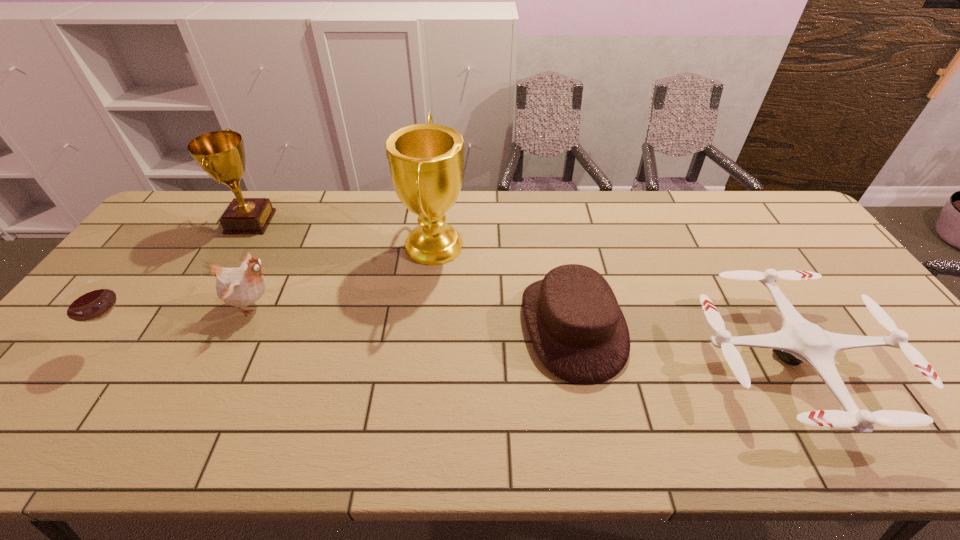
Locate an element on the screen. the tallest object is located at coordinates tap(426, 161).

Where is `the taller award`? This screenshot has height=540, width=960. the taller award is located at coordinates (426, 161).

The image size is (960, 540). What are the coordinates of `the second tallest object` in the screenshot? It's located at (221, 154).

Locate an element on the screen. This screenshot has height=540, width=960. the left award is located at coordinates (221, 154).

The image size is (960, 540). I want to click on bird, so click(x=240, y=287).

You are a GUI agent. You are given a task and a screenshot of the screen. Output one action in this format:
    pyautogui.click(x=<x>, y=<y>)
    Task: Click on the wineglass
    
    Given the screenshot: What is the action you would take?
    pyautogui.click(x=91, y=300)

The image size is (960, 540). I want to click on hat, so click(x=578, y=331).

Where is `the rightmost object`? the rightmost object is located at coordinates (798, 341).

Locate an element on the screen. This screenshot has width=960, height=540. free location located on the shiny surface of the tallest object is located at coordinates (556, 244).

Where is `free space located 0.340m on the plaque of the fifth shortest object`? free space located 0.340m on the plaque of the fifth shortest object is located at coordinates (374, 222).